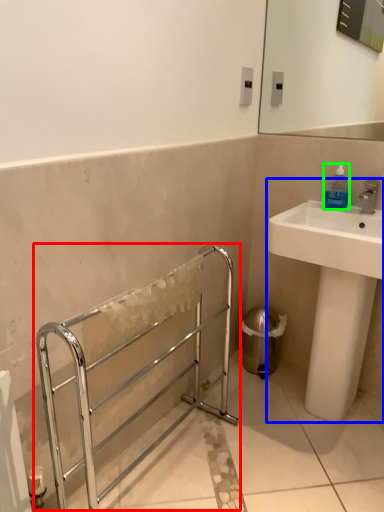
Question: Which object is positioned closest to balustrade (highlighted by a red box)? Select from sink (highlighted by a blue box) and bottle (highlighted by a green box).

Choices:
 (A) sink
 (B) bottle

Answer: (A)